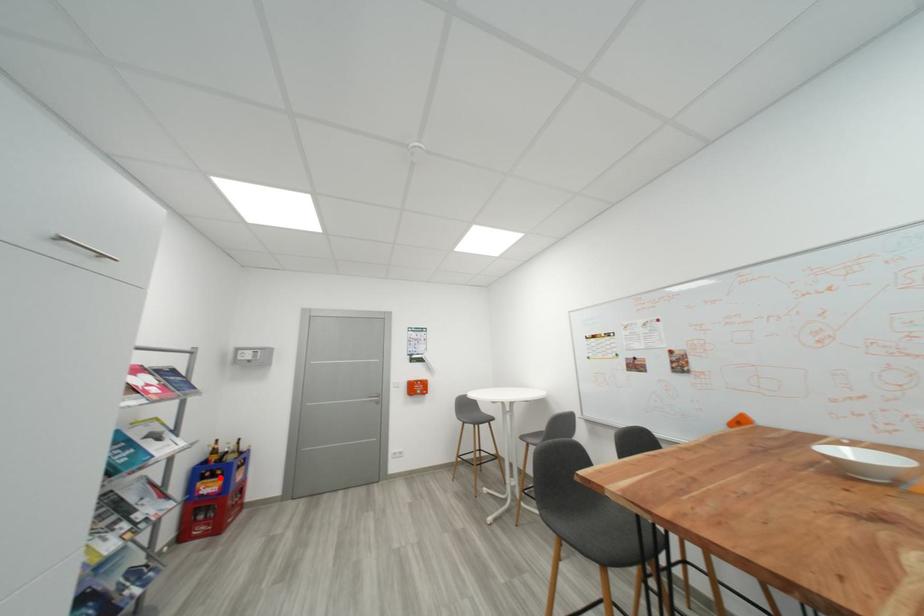
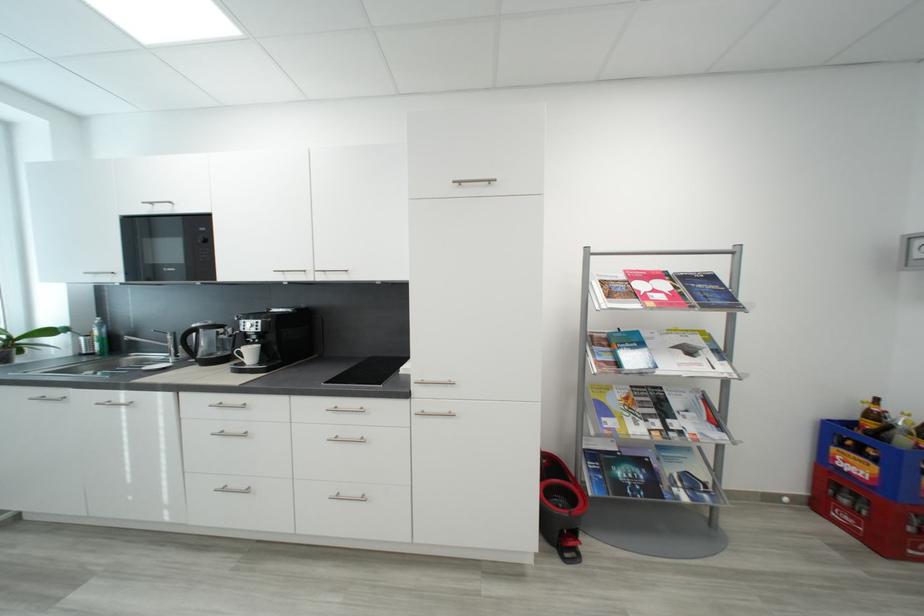
Question: A red point is marked in image1. In image2, is the corresponding 3D point closer to the camera or farther? Reply with the corresponding letter.

Choices:
 (A) The corresponding 3D point is closer.
 (B) The corresponding 3D point is farther.

Answer: (A)